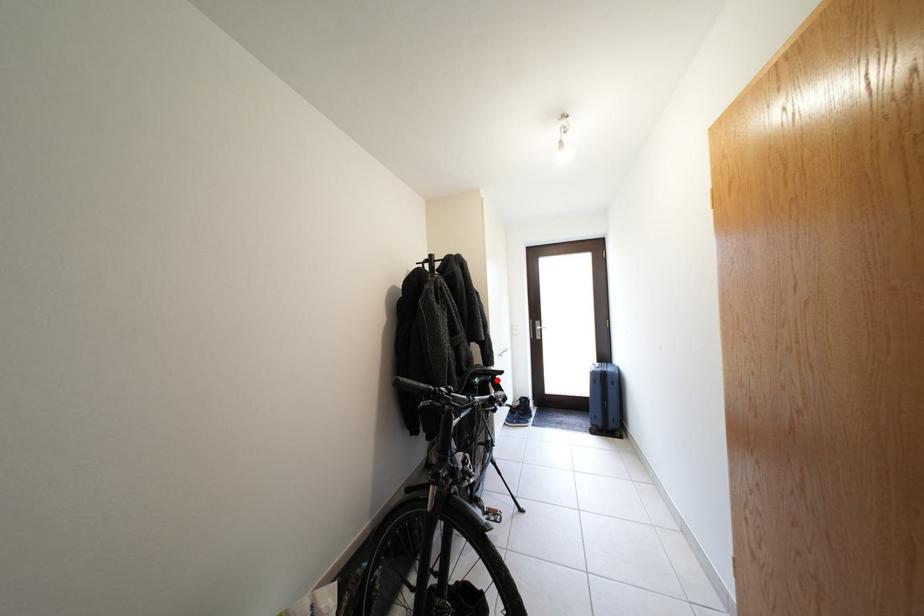
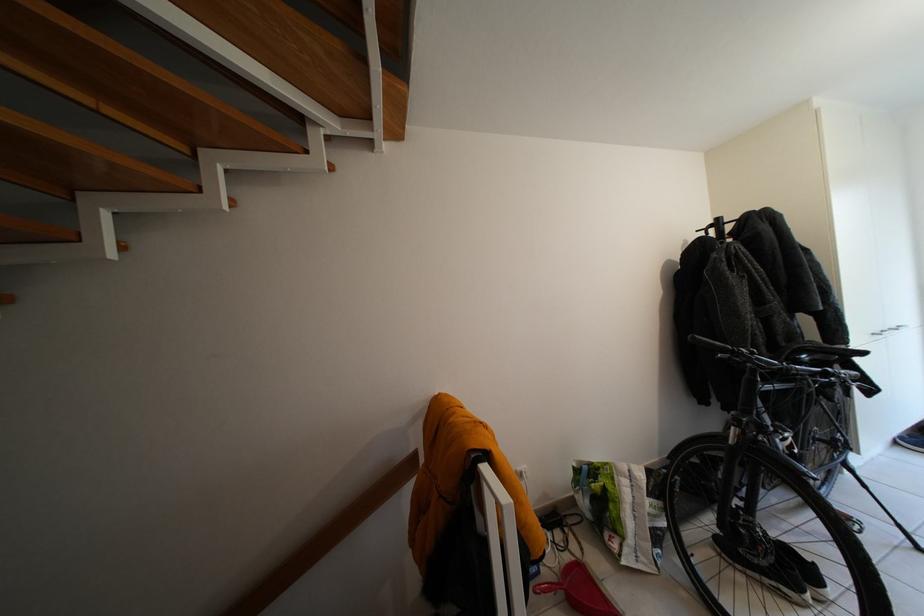
Question: I am providing you with two images of the same scene from different viewpoints. A red point is shown in image1. For the corresponding object point in image2, is it positioned nearer or farther from the camera?

Choices:
 (A) Nearer
 (B) Farther

Answer: (A)